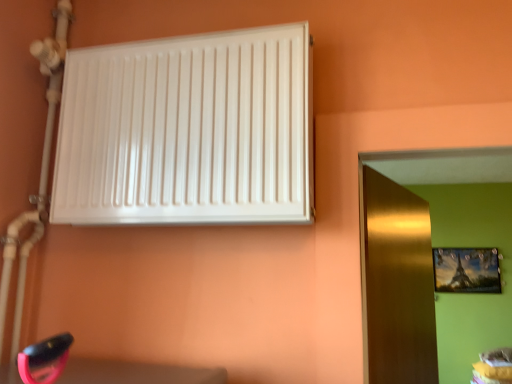
Question: Is gold metallic door at right in front of white glossy radiator at upper left?

Choices:
 (A) yes
 (B) no

Answer: (B)

Question: Does gold metallic door at right have a lesser width compared to white glossy radiator at upper left?

Choices:
 (A) no
 (B) yes

Answer: (B)

Question: Is gold metallic door at right oriented towards white glossy radiator at upper left?

Choices:
 (A) no
 (B) yes

Answer: (A)

Question: Is the surface of gold metallic door at right in direct contact with white glossy radiator at upper left?

Choices:
 (A) yes
 (B) no

Answer: (B)

Question: Is gold metallic door at right smaller than white glossy radiator at upper left?

Choices:
 (A) yes
 (B) no

Answer: (B)

Question: Is gold metallic door at right outside white glossy radiator at upper left?

Choices:
 (A) yes
 (B) no

Answer: (A)

Question: Can you confirm if white glossy radiator at upper left is shorter than metallic gold picture frame at upper right?

Choices:
 (A) no
 (B) yes

Answer: (B)

Question: From the image's perspective, is white glossy radiator at upper left beneath metallic gold picture frame at upper right?

Choices:
 (A) yes
 (B) no

Answer: (B)

Question: From the image's perspective, is white glossy radiator at upper left above metallic gold picture frame at upper right?

Choices:
 (A) yes
 (B) no

Answer: (A)

Question: Does white glossy radiator at upper left have a lesser width compared to metallic gold picture frame at upper right?

Choices:
 (A) yes
 (B) no

Answer: (B)

Question: Could you tell me if white glossy radiator at upper left is facing metallic gold picture frame at upper right?

Choices:
 (A) yes
 (B) no

Answer: (B)

Question: Is white glossy radiator at upper left completely or partially outside of metallic gold picture frame at upper right?

Choices:
 (A) no
 (B) yes

Answer: (B)

Question: From the image's perspective, is metallic gold picture frame at upper right located beneath white glossy radiator at upper left?

Choices:
 (A) no
 (B) yes

Answer: (B)